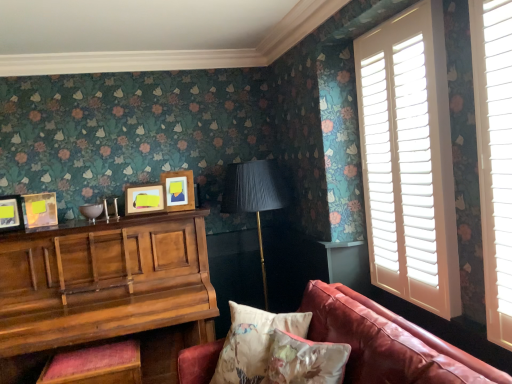
Find the location of a particular element. This screenshot has height=384, width=512. free space above white painted wood shutters at right (from a real-world perspective) is located at coordinates (395, 21).